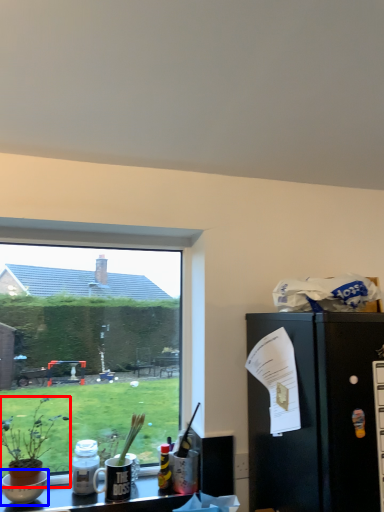
Question: Which object is further to the camera taking this photo, houseplant (highlighted by a red box) or bowl (highlighted by a blue box)?

Choices:
 (A) houseplant
 (B) bowl

Answer: (B)